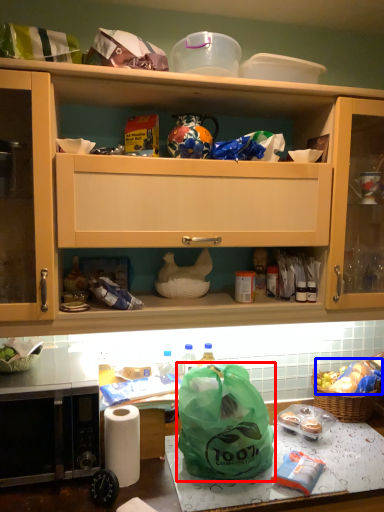
Question: Which point is closer to the camera, plastic bag (highlighted by a red box) or food (highlighted by a blue box)?

Choices:
 (A) plastic bag
 (B) food

Answer: (A)